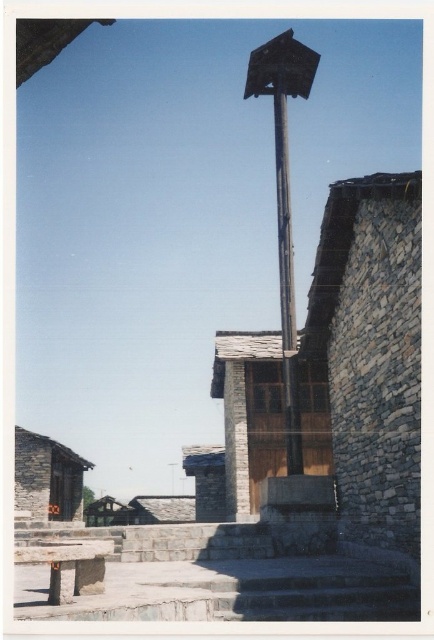
You are standing at the base of the stone steps in the rustic outdoor scene. You need to walk to the wooden hut at center. Which direction should you head relative to the wooden hut at lower left?

You should head to the right of the wooden hut at lower left to reach the wooden hut at center.

You are standing in front of the stone building and want to take a photo of the metallic pole at center and the smooth stone pillar at center. Which object will appear closer to the camera in the photo?

The metallic pole at center will appear closer to the camera in the photo because it is positioned in front of the smooth stone pillar at center according to the spatial arrangement described.